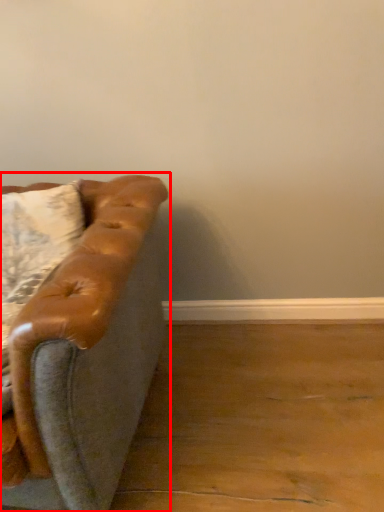
Question: Observing the image, what is the correct spatial positioning of studio couch (annotated by the red box) in reference to pillow?

Choices:
 (A) left
 (B) right

Answer: (A)